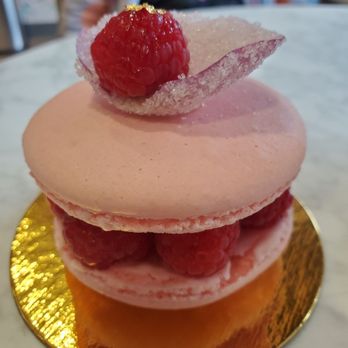
Locate an element on the screen. wall is located at coordinates (5, 44).